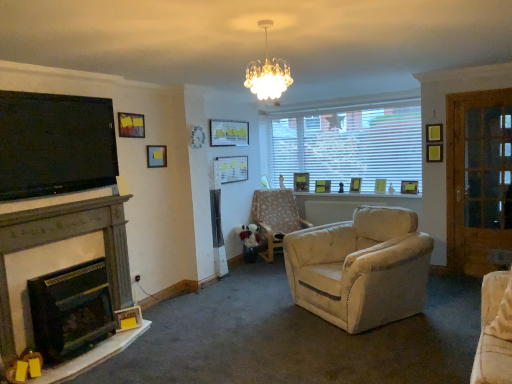
Where is `green painted wood fireplace at lower left, which is the 1th fireplace from bottom to top`? The width and height of the screenshot is (512, 384). green painted wood fireplace at lower left, which is the 1th fireplace from bottom to top is located at coordinates (71, 310).

Locate an element on the screen. Image resolution: width=512 pixels, height=384 pixels. matte white picture frame at center, placed as the 6th picture frame when sorted from back to front is located at coordinates (233, 168).

The width and height of the screenshot is (512, 384). In order to click on white blinds at upper center in this screenshot , I will do `click(347, 143)`.

Could you tell me if matte black tv at left is facing wooden picture frame at right, which is counted as the 1th picture frame, starting from the right?

No.

Can you confirm if matte black tv at left is positioned to the left of wooden picture frame at right, the 9th picture frame viewed from the left?

Indeed, matte black tv at left is positioned on the left side of wooden picture frame at right, the 9th picture frame viewed from the left.

In the scene shown: Is matte black tv at left spatially inside wooden picture frame at right, placed as the 5th picture frame when sorted from back to front, or outside of it?

matte black tv at left is outside wooden picture frame at right, placed as the 5th picture frame when sorted from back to front.

Which object is thinner, wooden glass door at right or floral fabric chair at center?

Thinner between the two is wooden glass door at right.

Between point (501, 145) and point (257, 214), which one is positioned behind?

The point (257, 214) is behind.

In the scene shown: Between wooden glass door at right and floral fabric chair at center, which one has larger size?

Bigger between the two is floral fabric chair at center.

Is wooden glass door at right completely or partially outside of floral fabric chair at center?

Yes.

From the image's perspective, which object appears higher, green painted wood fireplace at lower left, the second fireplace positioned from the top, or matte gold picture frame at window, the 4th picture frame viewed from the back?

matte gold picture frame at window, the 4th picture frame viewed from the back.

Between green painted wood fireplace at lower left, the second fireplace positioned from the top, and matte gold picture frame at window, the 4th picture frame viewed from the back, which one appears on the left side from the viewer's perspective?

green painted wood fireplace at lower left, the second fireplace positioned from the top.

How many degrees apart are the facing directions of green painted wood fireplace at lower left, which is the 1th fireplace from bottom to top, and matte gold picture frame at window, the 4th picture frame viewed from the back?

The angular difference between green painted wood fireplace at lower left, which is the 1th fireplace from bottom to top, and matte gold picture frame at window, the 4th picture frame viewed from the back, is 91.7 degrees.

From a real-world perspective, who is located higher, green painted wood fireplace at lower left, the second fireplace positioned from the top, or matte gold picture frame at window, the 4th picture frame viewed from the back?

matte gold picture frame at window, the 4th picture frame viewed from the back, from a real-world perspective.

Can you confirm if matte yellow picture frame at upper right, which ranks as the 7th picture frame in front-to-back order, is bigger than matte black picture frame at upper left, which is counted as the 9th picture frame, starting from the right?

Indeed, matte yellow picture frame at upper right, which ranks as the 7th picture frame in front-to-back order, has a larger size compared to matte black picture frame at upper left, which is counted as the 9th picture frame, starting from the right.

Considering the relative sizes of matte yellow picture frame at upper right, arranged as the 7th picture frame when viewed from the left, and matte black picture frame at upper left, which ranks as the 9th picture frame in back-to-front order, in the image provided, is matte yellow picture frame at upper right, arranged as the 7th picture frame when viewed from the left, taller than matte black picture frame at upper left, which ranks as the 9th picture frame in back-to-front order,?

Yes.

From the picture: Would you say matte yellow picture frame at upper right, which ranks as the 3th picture frame in back-to-front order, contains matte black picture frame at upper left, which ranks as the 9th picture frame in back-to-front order?

No, matte black picture frame at upper left, which ranks as the 9th picture frame in back-to-front order, is not surrounded by matte yellow picture frame at upper right, which ranks as the 3th picture frame in back-to-front order.

From the image's perspective, who appears lower, matte yellow picture frame at upper right, which ranks as the 7th picture frame in front-to-back order, or matte black picture frame at upper left, placed as the first picture frame when sorted from left to right?

From the image's view, matte yellow picture frame at upper right, which ranks as the 7th picture frame in front-to-back order, is below.

In the image, is matte yellow picture frame at window, arranged as the second picture frame when viewed from the back, on the left side or the right side of matte gold picture frame at window, the second picture frame positioned from the right?

From the image, it's evident that matte yellow picture frame at window, arranged as the second picture frame when viewed from the back, is to the left of matte gold picture frame at window, the second picture frame positioned from the right.

How much distance is there between matte yellow picture frame at window, which appears as the 4th picture frame when viewed from the right, and matte gold picture frame at window, the second picture frame positioned from the right?

matte yellow picture frame at window, which appears as the 4th picture frame when viewed from the right, and matte gold picture frame at window, the second picture frame positioned from the right, are 31.28 inches apart.

There is a matte yellow picture frame at window, which is counted as the 6th picture frame, starting from the left. At what (x,y) coordinates should I click in order to perform the action: click on the 1st picture frame below it (from a real-world perspective). Please return your answer as a coordinate pair (x, y). Looking at the image, I should click on (380, 186).

Can you confirm if matte yellow picture frame at window, placed as the 8th picture frame when sorted from front to back, is thinner than matte gold picture frame at window, arranged as the sixth picture frame when viewed from the front?

Incorrect, the width of matte yellow picture frame at window, placed as the 8th picture frame when sorted from front to back, is not less than that of matte gold picture frame at window, arranged as the sixth picture frame when viewed from the front.

Considering the sizes of crystalline glass chandelier at upper center and matte glass picture frame at upper center, positioned as the third picture frame in front-to-back order, in the image, is crystalline glass chandelier at upper center bigger or smaller than matte glass picture frame at upper center, positioned as the third picture frame in front-to-back order,?

In the image, crystalline glass chandelier at upper center appears to be larger than matte glass picture frame at upper center, positioned as the third picture frame in front-to-back order.

Is crystalline glass chandelier at upper center thinner than matte glass picture frame at upper center, positioned as the third picture frame in front-to-back order?

No, crystalline glass chandelier at upper center is not thinner than matte glass picture frame at upper center, positioned as the third picture frame in front-to-back order.

From a real-world perspective, is crystalline glass chandelier at upper center located higher than matte glass picture frame at upper center, positioned as the 7th picture frame in back-to-front order?

Yes.

Would you say crystalline glass chandelier at upper center is a long distance from matte glass picture frame at upper center, acting as the third picture frame starting from the left?

crystalline glass chandelier at upper center is far away from matte glass picture frame at upper center, acting as the third picture frame starting from the left.

Is matte white picture frame at center, placed as the 6th picture frame when sorted from back to front, bigger or smaller than crystalline glass chandelier at upper center?

Clearly, matte white picture frame at center, placed as the 6th picture frame when sorted from back to front, is smaller in size than crystalline glass chandelier at upper center.

From a real-world perspective, starting from the crystalline glass chandelier at upper center, which picture frame is the 4th one below it? Please provide its 2D coordinates.

[(233, 168)]

Which is less distant, (221, 167) or (254, 64)?

Point (221, 167) is farther from the camera than point (254, 64).

Could you tell me if matte white picture frame at center, the 4th picture frame positioned from the front, is turned towards crystalline glass chandelier at upper center?

No, matte white picture frame at center, the 4th picture frame positioned from the front, is not turned towards crystalline glass chandelier at upper center.

From the matte black tv at left, count 9th picture frame to the right and point to it. Please provide its 2D coordinates.

[(409, 187)]

Find the location of a particular element. glass door above the floral fabric chair at center (from the image's perspective) is located at coordinates (478, 179).

Based on their spatial positions, is wooden picture frame at right, placed as the 5th picture frame when sorted from back to front, or matte white picture frame at center, placed as the 6th picture frame when sorted from back to front, closer to crystalline glass chandelier at upper center?

The object closer to crystalline glass chandelier at upper center is matte white picture frame at center, placed as the 6th picture frame when sorted from back to front.

Looking at this image, based on their spatial positions, is matte yellow picture frame at upper right, which ranks as the 7th picture frame in front-to-back order, or wooden glass door at right further from matte wooden picture frame at center, arranged as the ninth picture frame when viewed from the front?

wooden glass door at right lies further to matte wooden picture frame at center, arranged as the ninth picture frame when viewed from the front, than the other object.

Considering their positions, is green painted wood fireplace at lower left, the second fireplace positioned from the top, positioned further to wooden glass door at right than floral fabric chair at center?

green painted wood fireplace at lower left, the second fireplace positioned from the top, is further to wooden glass door at right.

When comparing their distances from matte gold picture frame at window, the 8th picture frame positioned from the left, does floral fabric chair at center or matte yellow picture frame at upper right, which ranks as the 7th picture frame in front-to-back order, seem closer?

matte yellow picture frame at upper right, which ranks as the 7th picture frame in front-to-back order.

When comparing their distances from matte black picture frame at upper left, placed as the first picture frame when sorted from left to right, does matte glass picture frame at upper center, positioned as the third picture frame in front-to-back order, or wooden glass door at right seem closer?

matte glass picture frame at upper center, positioned as the third picture frame in front-to-back order.

Considering their positions, is crystalline glass chandelier at upper center positioned further to matte white picture frame at center, which appears as the 6th picture frame when viewed from the right, than wooden picture frame at upper left, positioned as the second picture frame in left-to-right order?

crystalline glass chandelier at upper center is positioned further to the anchor matte white picture frame at center, which appears as the 6th picture frame when viewed from the right.

Based on their spatial positions, is matte yellow picture frame at upper right, arranged as the 7th picture frame when viewed from the left, or wooden glass door at right further from matte gold picture frame at window, the second picture frame positioned from the right?

wooden glass door at right is positioned further to the anchor matte gold picture frame at window, the second picture frame positioned from the right.

From the image, which object appears to be farther from floral fabric chair at center, matte white picture frame at center, the 4th picture frame positioned from the front, or wooden glass door at right?

Among the two, wooden glass door at right is located further to floral fabric chair at center.

Locate an element on the screen. This screenshot has width=512, height=384. chair between crystalline glass chandelier at upper center and matte gold picture frame at window, the 8th picture frame positioned from the left, along the z-axis is located at coordinates (276, 217).

Locate an element on the screen. This screenshot has height=384, width=512. window positioned between dark gray stone fireplace at left, the second fireplace from the bottom, and matte yellow picture frame at upper right, which ranks as the 7th picture frame in front-to-back order, from near to far is located at coordinates (347, 143).

The height and width of the screenshot is (384, 512). Identify the location of window located between matte glass picture frame at upper center, acting as the third picture frame starting from the left, and wooden picture frame at right, placed as the fifth picture frame when sorted from front to back, in the left-right direction. (347, 143).

You are a GUI agent. You are given a task and a screenshot of the screen. Output one action in this format:
    pyautogui.click(x=<x>, y=<y>)
    Task: Click on the chair positioned between matte black tv at left and matte yellow picture frame at window, arranged as the second picture frame when viewed from the back, from near to far
    
    Given the screenshot: What is the action you would take?
    pyautogui.click(x=276, y=217)